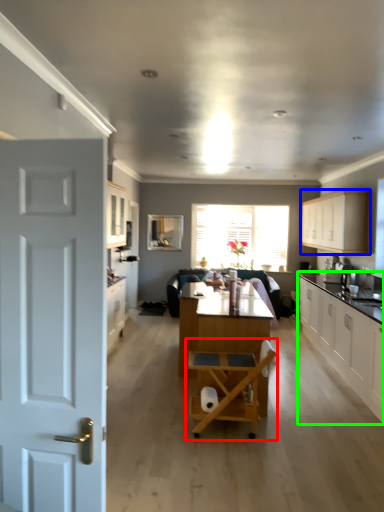
Question: Which object is positioned farthest from chair (highlighted by a red box)? Select from cabinetry (highlighted by a blue box) and cabinetry (highlighted by a green box).

Choices:
 (A) cabinetry
 (B) cabinetry

Answer: (A)